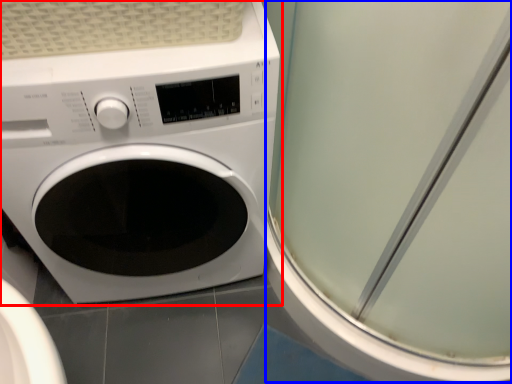
Question: Which point is further to the camera, washing machine (highlighted by a red box) or screen door (highlighted by a blue box)?

Choices:
 (A) washing machine
 (B) screen door

Answer: (A)